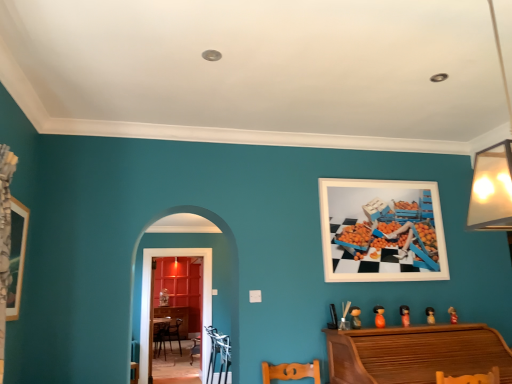
At what (x,y) coordinates should I click in order to perform the action: click on free point above white matte picture frame at upper right, the 2th picture frame from the front (from a real-world perspective). Please return your answer as a coordinate pair (x, y). This screenshot has width=512, height=384. Looking at the image, I should click on (377, 179).